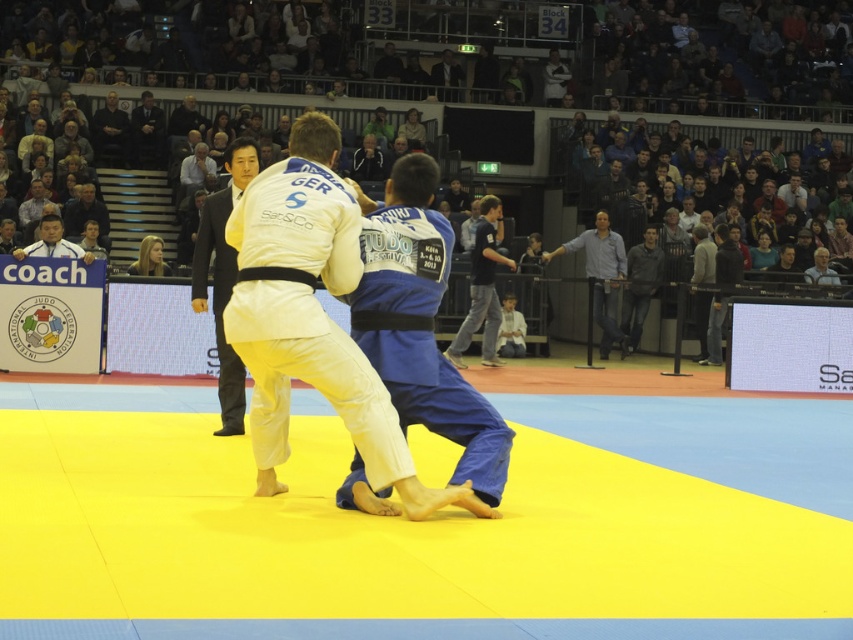
You are a photographer at the judo match. You need to capture a closeup shot of both the dark blue jeans at center and the matte black shirt at upper left in a single frame. Which object should you zoom in on more to ensure both are clearly visible?

The dark blue jeans at center is thinner than matte black shirt at upper left, so you should zoom in more on the matte black shirt at upper left to ensure both objects are clearly visible in the frame.

You are a photographer at the judo match. You need to capture a closeup shot of the white cotton kimono at center and the matte black shirt at upper left in the same frame. Which garment should you zoom in on first to ensure both are in focus?

The white cotton kimono at center is narrower than the matte black shirt at upper left, so you should zoom in on the matte black shirt at upper left first to ensure both are in focus.